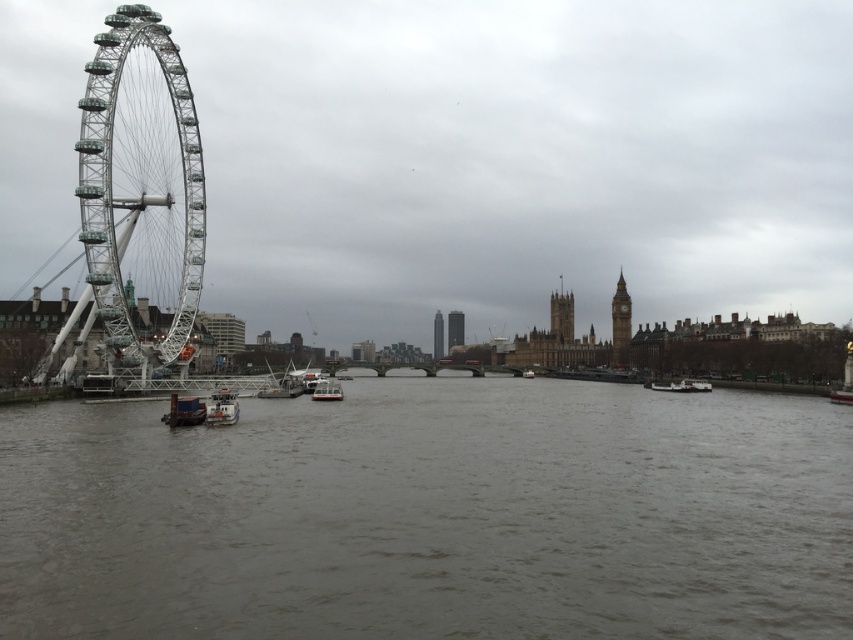
Is brown stone clock tower at center-right in front of metallic gray boat at center?

No, it is behind metallic gray boat at center.

Is point (612, 316) in front of point (273, 390)?

That is False.

Who is more distant from viewer, (619, 332) or (289, 364)?

Positioned behind is point (619, 332).

You are a GUI agent. You are given a task and a screenshot of the screen. Output one action in this format:
    pyautogui.click(x=<x>, y=<y>)
    Task: Click on the brown stone clock tower at center-right
    
    Given the screenshot: What is the action you would take?
    pyautogui.click(x=619, y=323)

Between white matte boat at right and metallic silver boat at center, which one is positioned lower?

white matte boat at right is below.

Is white matte boat at right below metallic silver boat at center?

Indeed, white matte boat at right is positioned under metallic silver boat at center.

Find the location of a particular element. The image size is (853, 640). white matte boat at right is located at coordinates (682, 385).

The width and height of the screenshot is (853, 640). Identify the location of white matte boat at right. (682, 385).

Between gray matte water at center and metallic gray boat at center, which one appears on the left side from the viewer's perspective?

metallic gray boat at center

Who is more forward, (779, 628) or (257, 394)?

Point (779, 628) is in front.

The height and width of the screenshot is (640, 853). In order to click on gray matte water at center in this screenshot , I will do `click(432, 515)`.